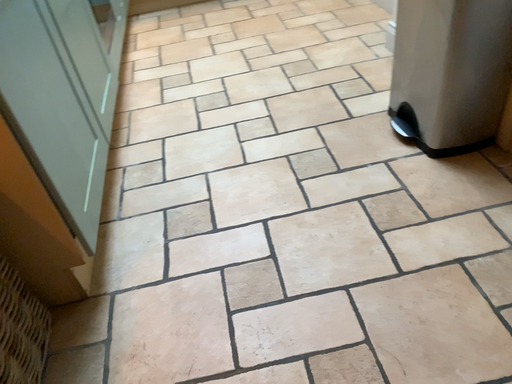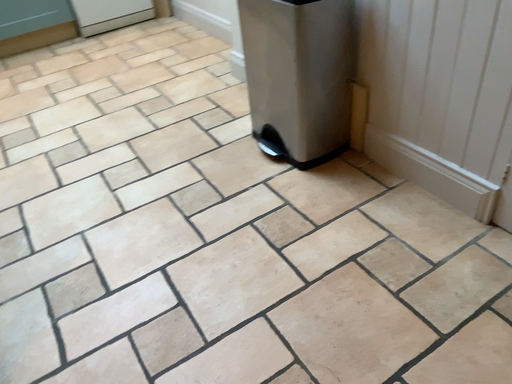
Question: How did the camera likely rotate when shooting the video?

Choices:
 (A) rotated right
 (B) rotated left

Answer: (A)